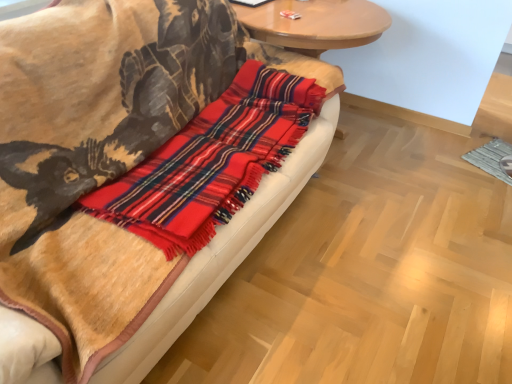
This screenshot has height=384, width=512. What do you see at coordinates (315, 24) in the screenshot?
I see `wooden round table at upper center` at bounding box center [315, 24].

Describe the element at coordinates (211, 162) in the screenshot. The width and height of the screenshot is (512, 384). I see `red plaid flannel at center` at that location.

This screenshot has height=384, width=512. Describe the element at coordinates (102, 123) in the screenshot. I see `plaid wool blanket at center` at that location.

This screenshot has height=384, width=512. Identify the location of wooden round table at upper center. (315, 24).

Looking at this image, between plaid wool blanket at center and red plaid flannel at center, which one has larger width?

Wider between the two is plaid wool blanket at center.

From a real-world perspective, is plaid wool blanket at center positioned above or below red plaid flannel at center?

plaid wool blanket at center is below red plaid flannel at center.

Considering the sizes of objects red plaid flannel at center and plaid wool blanket at center in the image provided, who is bigger, red plaid flannel at center or plaid wool blanket at center?

Bigger between the two is plaid wool blanket at center.

From the image's perspective, is red plaid flannel at center positioned above or below plaid wool blanket at center?

red plaid flannel at center is situated higher than plaid wool blanket at center in the image.

Is red plaid flannel at center not inside plaid wool blanket at center?

No, most part of red plaid flannel at center lies within plaid wool blanket at center.

Image resolution: width=512 pixels, height=384 pixels. What are the coordinates of `studio couch that is on the left side of red plaid flannel at center` in the screenshot? It's located at (102, 123).

Consider the image. How different are the orientations of wooden round table at upper center and plaid wool blanket at center in degrees?

0.717 degrees separate the facing orientations of wooden round table at upper center and plaid wool blanket at center.

Is plaid wool blanket at center at the back of wooden round table at upper center?

wooden round table at upper center is not turned away from plaid wool blanket at center.

From the image's perspective, would you say wooden round table at upper center is positioned over plaid wool blanket at center?

Correct, wooden round table at upper center appears higher than plaid wool blanket at center in the image.

Is plaid wool blanket at center inside wooden round table at upper center?

No.

Choose the correct answer: Is wooden round table at upper center inside red plaid flannel at center or outside it?

wooden round table at upper center lies outside red plaid flannel at center.

Which is closer to the camera, (285,35) or (258,135)?

Point (285,35) is positioned farther from the camera compared to point (258,135).

From a real-world perspective, is wooden round table at upper center above or below red plaid flannel at center?

Clearly, from a real-world perspective, wooden round table at upper center is below red plaid flannel at center.

Who is shorter, wooden round table at upper center or red plaid flannel at center?

red plaid flannel at center.

In terms of height, does red plaid flannel at center look taller or shorter compared to wooden round table at upper center?

In the image, red plaid flannel at center appears to be shorter than wooden round table at upper center.

Can you see red plaid flannel at center touching wooden round table at upper center?

No, red plaid flannel at center is not in contact with wooden round table at upper center.

From the image's perspective, is red plaid flannel at center located above or below wooden round table at upper center?

Based on their image positions, red plaid flannel at center is located beneath wooden round table at upper center.

Does red plaid flannel at center have a greater width compared to wooden round table at upper center?

Incorrect, the width of red plaid flannel at center does not surpass that of wooden round table at upper center.

Which is more to the right, plaid wool blanket at center or wooden round table at upper center?

wooden round table at upper center.

Is plaid wool blanket at center shorter than wooden round table at upper center?

Incorrect, the height of plaid wool blanket at center does not fall short of that of wooden round table at upper center.

From the image's perspective, which object appears higher, plaid wool blanket at center or wooden round table at upper center?

From the image's view, wooden round table at upper center is above.

Considering the relative sizes of plaid wool blanket at center and wooden round table at upper center in the image provided, is plaid wool blanket at center smaller than wooden round table at upper center?

Incorrect, plaid wool blanket at center is not smaller in size than wooden round table at upper center.

Identify the location of flannel above the plaid wool blanket at center (from the image's perspective). This screenshot has height=384, width=512. (211, 162).

The height and width of the screenshot is (384, 512). In order to click on studio couch that appears below the red plaid flannel at center (from the image's perspective) in this screenshot , I will do `click(102, 123)`.

Considering their positions, is red plaid flannel at center positioned further to plaid wool blanket at center than wooden round table at upper center?

wooden round table at upper center.

Based on their spatial positions, is wooden round table at upper center or red plaid flannel at center closer to plaid wool blanket at center?

red plaid flannel at center is closer to plaid wool blanket at center.

From the image, which object appears to be farther from red plaid flannel at center, plaid wool blanket at center or wooden round table at upper center?

wooden round table at upper center is further to red plaid flannel at center.

Based on the photo, which object lies nearer to the anchor point wooden round table at upper center, red plaid flannel at center or plaid wool blanket at center?

red plaid flannel at center.

Considering their positions, is wooden round table at upper center positioned closer to red plaid flannel at center than plaid wool blanket at center?

Among the two, plaid wool blanket at center is located nearer to red plaid flannel at center.

Which object lies nearer to the anchor point wooden round table at upper center, plaid wool blanket at center or red plaid flannel at center?

The object closer to wooden round table at upper center is red plaid flannel at center.

Find the location of `flannel between plaid wool blanket at center and wooden round table at upper center along the z-axis`. flannel between plaid wool blanket at center and wooden round table at upper center along the z-axis is located at coordinates (211, 162).